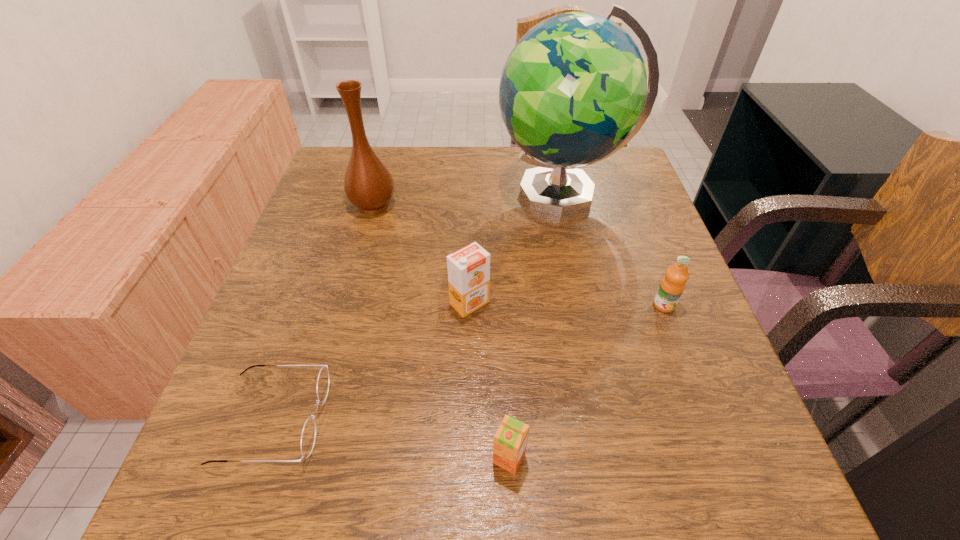
Identify the location of vacant region at the near right corner of the desktop. [x=751, y=484].

This screenshot has height=540, width=960. I want to click on empty location between the fifth shortest object and the tallest object, so click(x=468, y=199).

You are a GUI agent. You are given a task and a screenshot of the screen. Output one action in this format:
    pyautogui.click(x=<x>, y=<y>)
    Task: Click on the free space between the globe and the vase
    The width and height of the screenshot is (960, 540).
    Given the screenshot: What is the action you would take?
    pyautogui.click(x=468, y=199)

I want to click on free space between the rightmost orange juice and the nearest orange juice, so pos(587,382).

The image size is (960, 540). Identify the location of vacant region between the globe and the rightmost orange juice. (612, 249).

Identify the location of object that is the fifth closest to the rightmost orange juice. The image size is (960, 540). (309, 432).

This screenshot has height=540, width=960. Find the location of `object that is the closest to the shortest object`. object that is the closest to the shortest object is located at coordinates (468, 268).

You are a GUI agent. You are given a task and a screenshot of the screen. Output one action in this format:
    pyautogui.click(x=<x>, y=<y>)
    Task: Click on the orange juice identified as the closest to the second tallest object
    Image resolution: width=960 pixels, height=540 pixels.
    Given the screenshot: What is the action you would take?
    pyautogui.click(x=468, y=268)

Locate an element on the screen. The width and height of the screenshot is (960, 540). orange juice that is the second closest to the second tallest object is located at coordinates pos(510,440).

The width and height of the screenshot is (960, 540). What are the coordinates of `free space that satisfies the following two spatial constraints: 1. on the front surface of the globe; 2. on the front side of the nearest orange juice` in the screenshot? It's located at (621, 458).